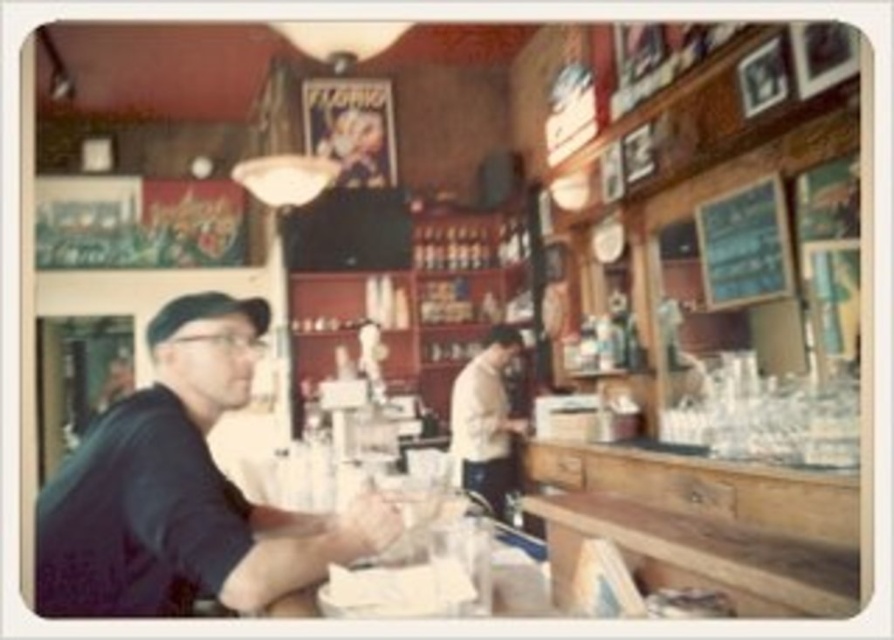
Question: Does dark blue shirt at left have a lesser width compared to light beige sweater at center?

Choices:
 (A) yes
 (B) no

Answer: (B)

Question: Which point is closer to the camera?

Choices:
 (A) (741, 204)
 (B) (221, 358)

Answer: (B)

Question: Does dark blue shirt at left appear over green chalkboard at upper right?

Choices:
 (A) no
 (B) yes

Answer: (A)

Question: Estimate the real-world distances between objects in this image. Which object is closer to the green chalkboard at upper right?

Choices:
 (A) light beige sweater at center
 (B) dark blue shirt at left

Answer: (A)

Question: In this image, where is dark blue shirt at left located relative to green chalkboard at upper right?

Choices:
 (A) above
 (B) below

Answer: (B)

Question: Which point is farther to the camera?

Choices:
 (A) green chalkboard at upper right
 (B) dark blue shirt at left

Answer: (A)